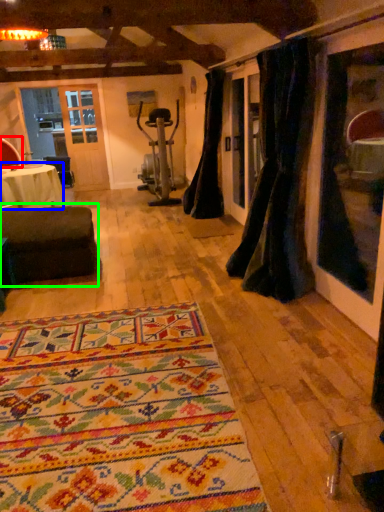
Question: Based on their relative distances, which object is nearer to armchair (highlighted by a red box)? Choose from table (highlighted by a blue box) and studio couch (highlighted by a green box).

Choices:
 (A) table
 (B) studio couch

Answer: (A)